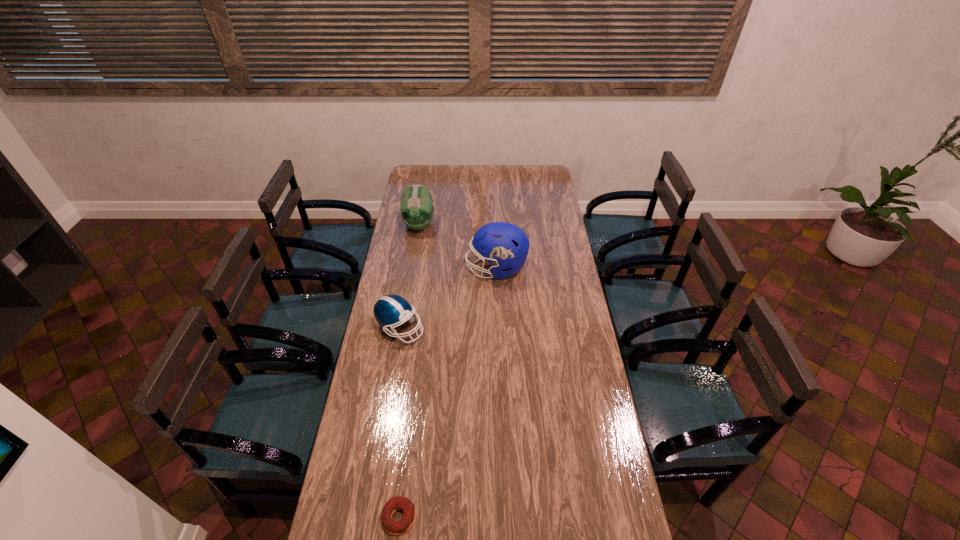
Locate an element on the screen. This screenshot has height=540, width=960. object that stands as the second closest to the doughnut is located at coordinates (504, 245).

In order to click on football helmet identified as the closest to the second farthest object in this screenshot , I will do tap(416, 208).

Point out which football helmet is positioned as the second nearest to the farthest football helmet. Please provide its 2D coordinates. Your answer should be formatted as a tuple, i.e. [(x, y)], where the tuple contains the x and y coordinates of a point satisfying the conditions above.

[(390, 310)]

Locate an element on the screen. This screenshot has width=960, height=540. vacant space that satisfies the following two spatial constraints: 1. at the front of the nearest football helmet with the faceguard; 2. on the right side of the nearest object is located at coordinates (369, 517).

The height and width of the screenshot is (540, 960). Identify the location of blank area in the image that satisfies the following two spatial constraints: 1. on the visor of the second shortest football helmet; 2. on the left side of the doughnut. (372, 517).

The width and height of the screenshot is (960, 540). I want to click on free space that satisfies the following two spatial constraints: 1. on the visor of the second tallest object; 2. at the front of the third tallest object with the faceguard, so click(402, 328).

This screenshot has height=540, width=960. Find the location of `free space that satisfies the following two spatial constraints: 1. at the front of the second nearest object with the faceguard; 2. on the left side of the doughnut`. free space that satisfies the following two spatial constraints: 1. at the front of the second nearest object with the faceguard; 2. on the left side of the doughnut is located at coordinates (369, 517).

The width and height of the screenshot is (960, 540). In order to click on vacant region that satisfies the following two spatial constraints: 1. on the back side of the nearest object; 2. at the front of the nearest football helmet with the faceguard in this screenshot , I will do `click(421, 328)`.

Where is `free space that satisfies the following two spatial constraints: 1. at the front of the second shortest object with the faceguard; 2. on the right side of the shortest object`? free space that satisfies the following two spatial constraints: 1. at the front of the second shortest object with the faceguard; 2. on the right side of the shortest object is located at coordinates (369, 517).

Where is `free spot that satisfies the following two spatial constraints: 1. at the front of the nearest football helmet with the faceguard; 2. on the back side of the nearest object`? free spot that satisfies the following two spatial constraints: 1. at the front of the nearest football helmet with the faceguard; 2. on the back side of the nearest object is located at coordinates (369, 517).